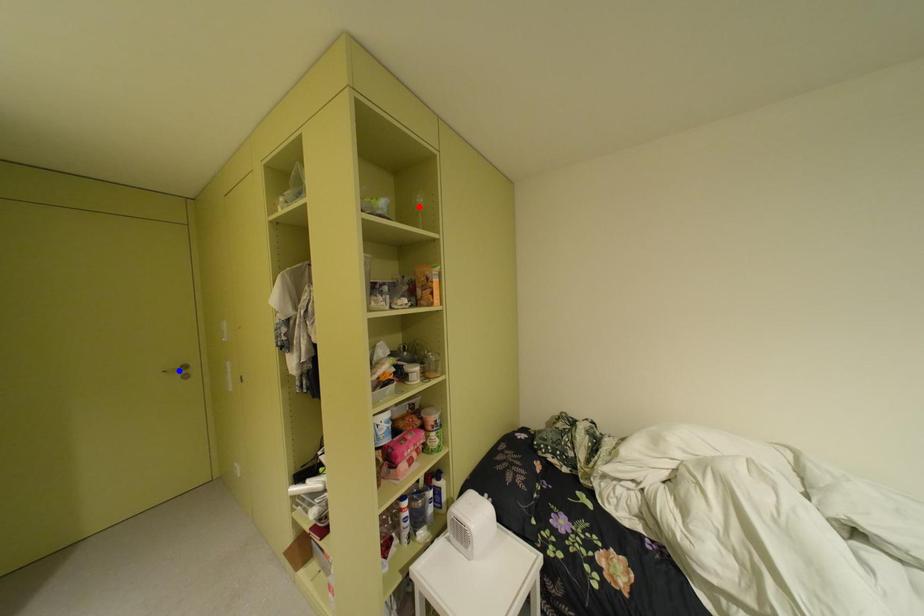
Question: Which of the two points in the image is closer to the camera?

Choices:
 (A) Blue point is closer.
 (B) Red point is closer.

Answer: (B)